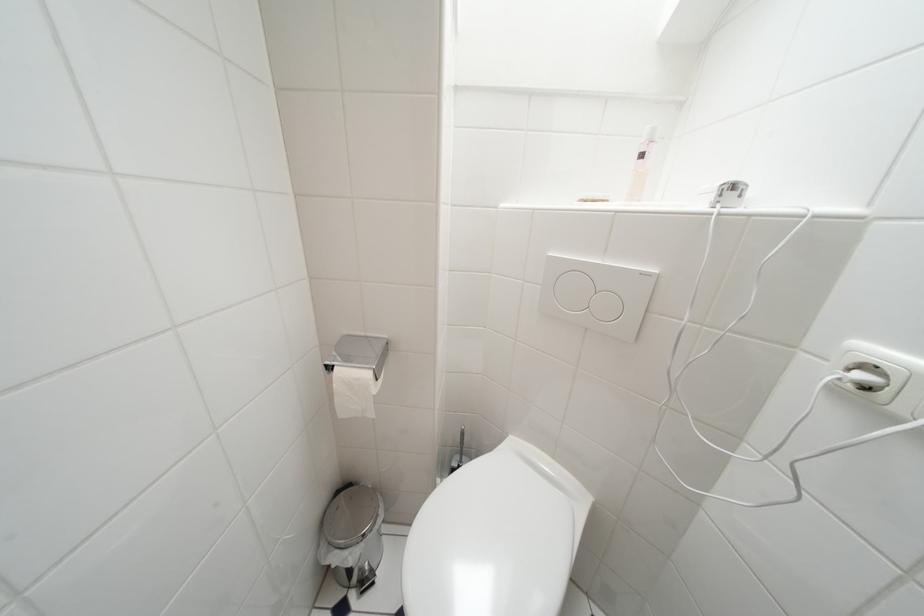
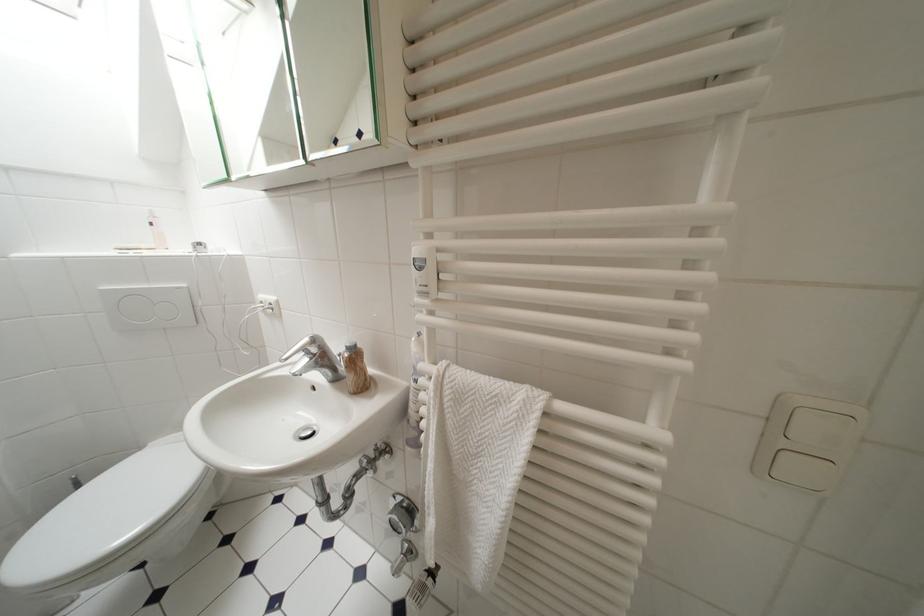
Find the pixel in the second image that matches (x=649, y=160) in the first image.

(159, 227)